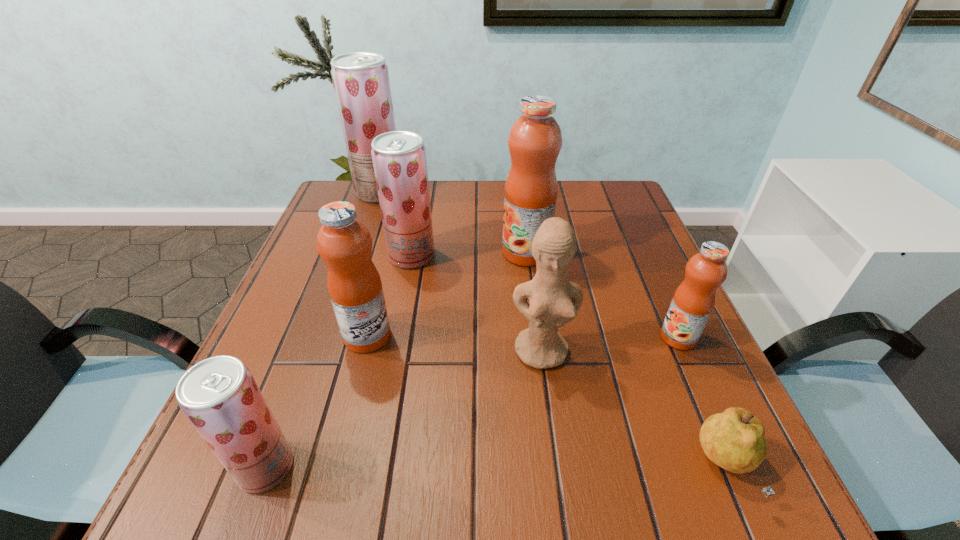
What are the coordinates of `free space located 0.270m on the right of the nearest strawberry fruit juice` in the screenshot? It's located at (466, 467).

Where is `vacant space located 0.390m on the front label of the rightmost orange fruit juice`? vacant space located 0.390m on the front label of the rightmost orange fruit juice is located at coordinates (468, 338).

The width and height of the screenshot is (960, 540). I want to click on vacant space situated 0.360m on the front label of the rightmost orange fruit juice, so pyautogui.click(x=483, y=338).

Where is `free region located on the front label of the rightmost orange fruit juice`? This screenshot has width=960, height=540. free region located on the front label of the rightmost orange fruit juice is located at coordinates (497, 338).

Find the location of `free point located 0.270m on the back of the pear`. free point located 0.270m on the back of the pear is located at coordinates (662, 314).

The image size is (960, 540). I want to click on object positioned at the far edge, so (x=361, y=83).

The height and width of the screenshot is (540, 960). What are the coordinates of `fruit juice at the near edge` in the screenshot? It's located at (219, 396).

Locate an element on the screen. The height and width of the screenshot is (540, 960). pear located at the near edge is located at coordinates (734, 440).

Locate an element on the screen. The width and height of the screenshot is (960, 540). fruit juice present at the right edge is located at coordinates (693, 302).

I want to click on pear located at the right edge, so click(x=734, y=440).